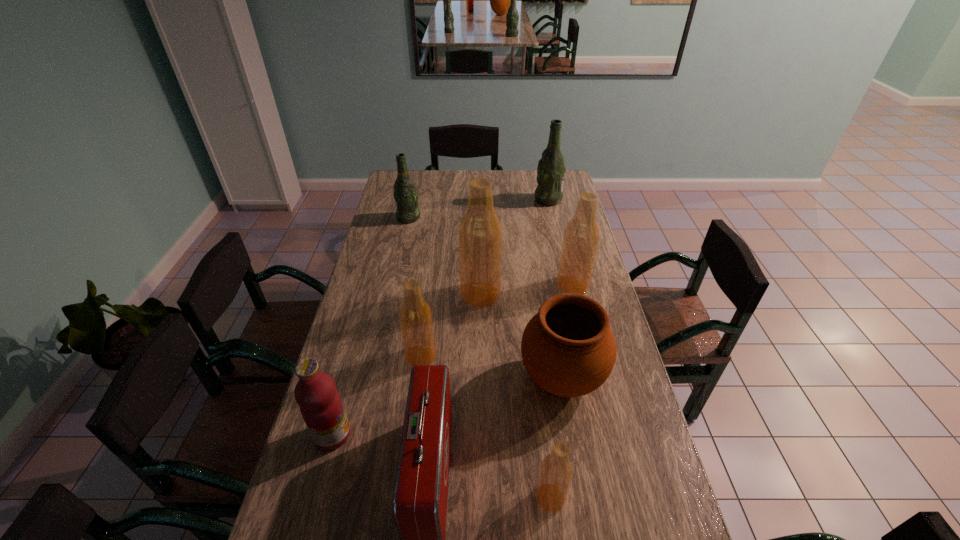
At what (x,y) coordinates should I click in order to perform the action: click on pottery. Please return your answer as a coordinate pair (x, y). This screenshot has width=960, height=540. Looking at the image, I should click on (568, 348).

The height and width of the screenshot is (540, 960). I want to click on the shortest object, so 556,471.

The height and width of the screenshot is (540, 960). I want to click on the smallest tan beer bottle, so click(556, 471).

Image resolution: width=960 pixels, height=540 pixels. What are the coordinates of `free space located 0.370m on the back of the tallest beer bottle` in the screenshot? It's located at (480, 225).

Locate an element on the screen. The image size is (960, 540). vacant space located on the surface of the farthest object is located at coordinates (460, 199).

Find the location of a particular element. The width and height of the screenshot is (960, 540). vacant space located 0.080m on the surface of the farthest object is located at coordinates (517, 199).

You are a GUI agent. You are given a task and a screenshot of the screen. Output one action in this format:
    pyautogui.click(x=<x>, y=<y>)
    Task: Click on the vacant area situated 0.160m on the surface of the farthest object
    This screenshot has width=960, height=540.
    Given the screenshot: What is the action you would take?
    pyautogui.click(x=500, y=199)

The image size is (960, 540). I want to click on free location located 0.360m on the back of the rightmost tan beer bottle, so click(558, 221).

Find the location of a particular element. The height and width of the screenshot is (540, 960). vacant point located 0.280m on the surface of the fifth nearest beer bottle is located at coordinates (398, 265).

The image size is (960, 540). Find the location of `vacant space located on the back of the third farthest tan beer bottle`. vacant space located on the back of the third farthest tan beer bottle is located at coordinates (429, 292).